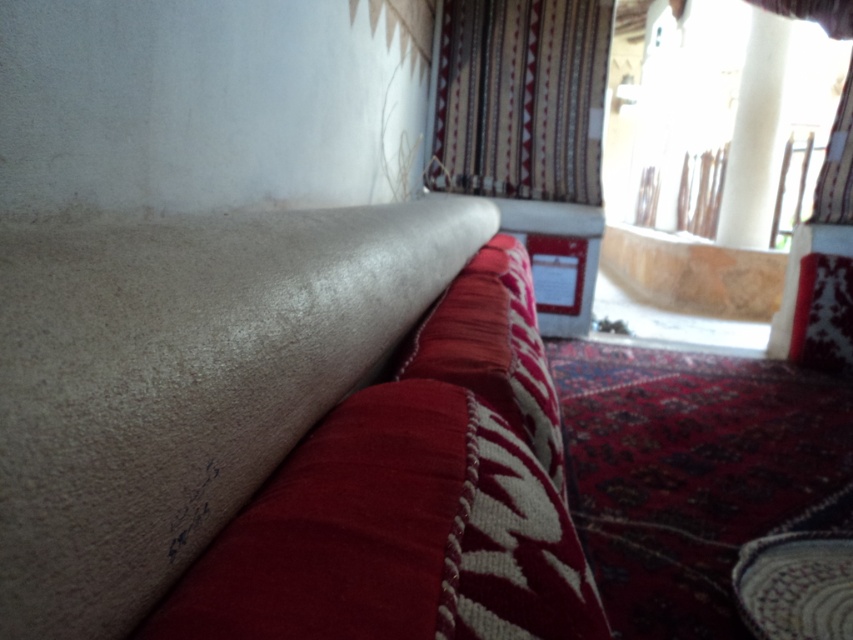
You are standing in the room depicted in the scene. There is a point marked at coordinates (521, 99). What object in the scene corresponds to this point?

The point at coordinates (521, 99) corresponds to the patterned fabric curtain at upper center.